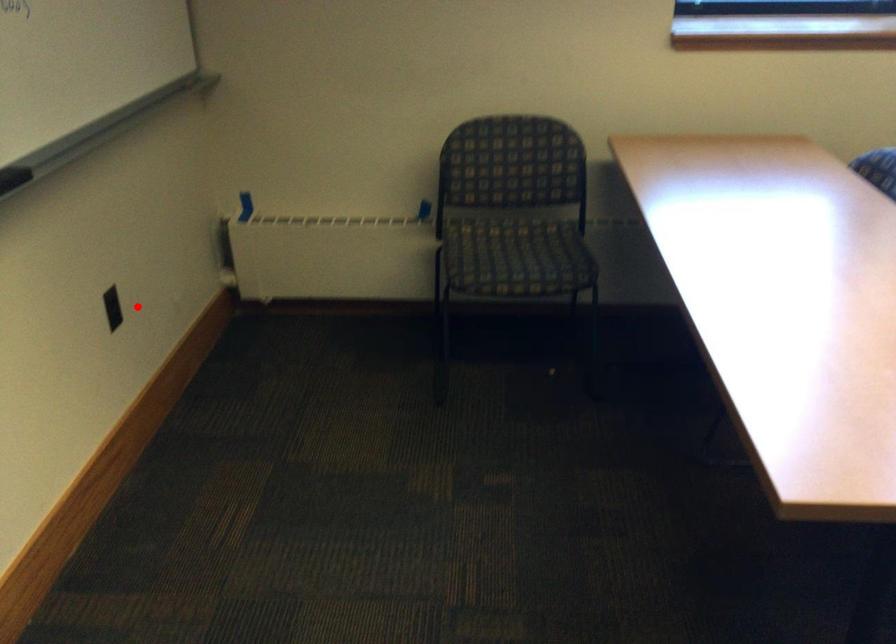
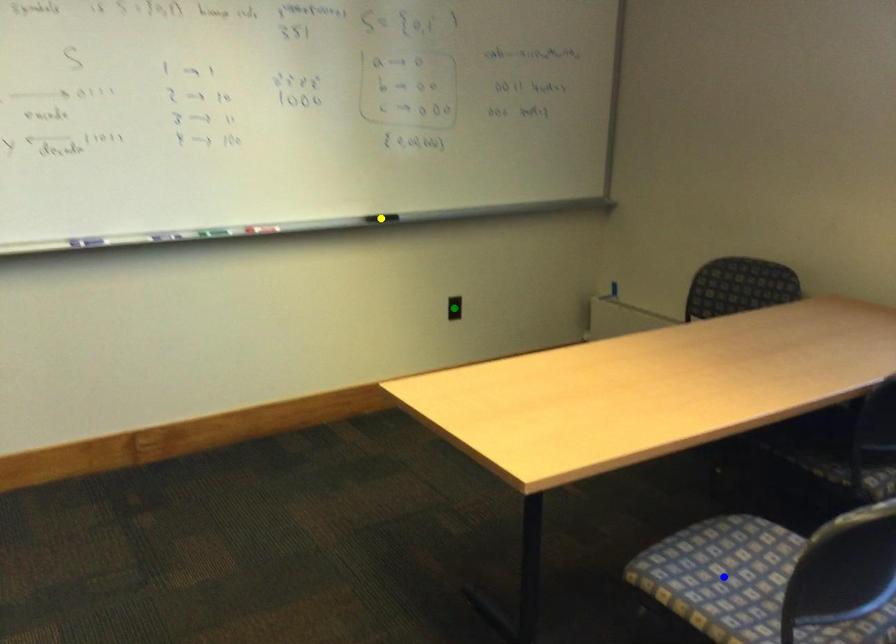
Question: I am providing you with two images of the same scene from different viewpoints. A red point is marked on the first image. You are given multiple points on the second image. Which spot in image 2 lines up with the point in image 1?

Choices:
 (A) blue point
 (B) yellow point
 (C) green point

Answer: (C)